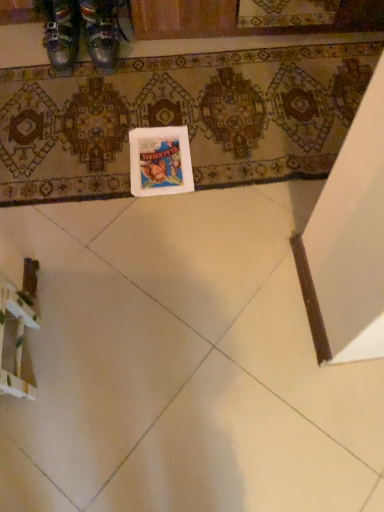
The image size is (384, 512). Identify the location of vacant space to the right of white matte postcard at center. (225, 152).